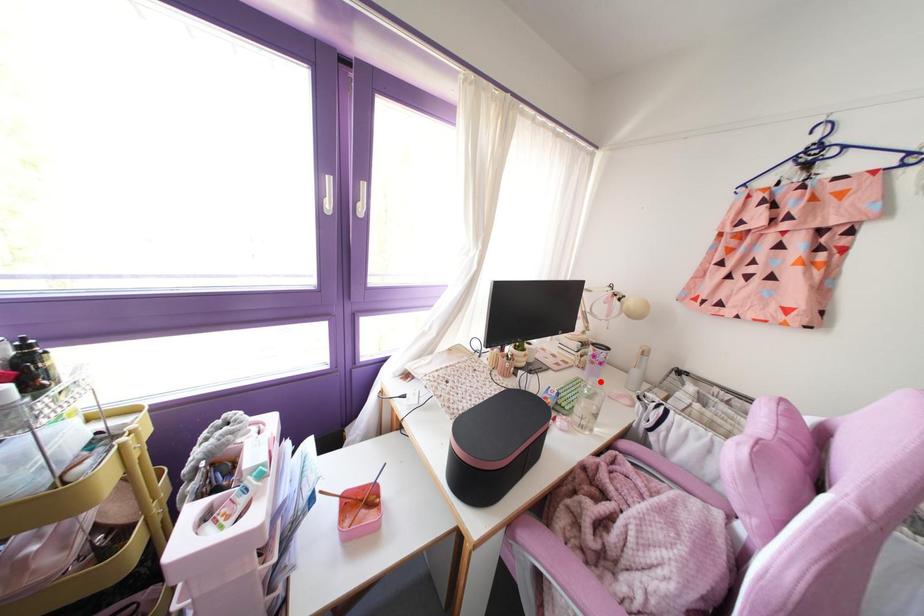
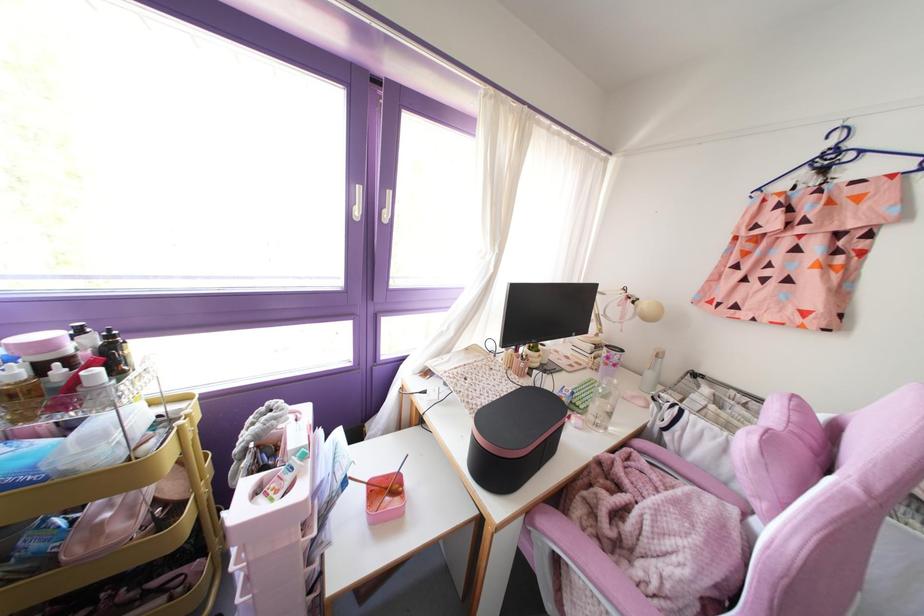
Where in the second image is the point corresponding to the highlighted location from the first image?

(614, 381)